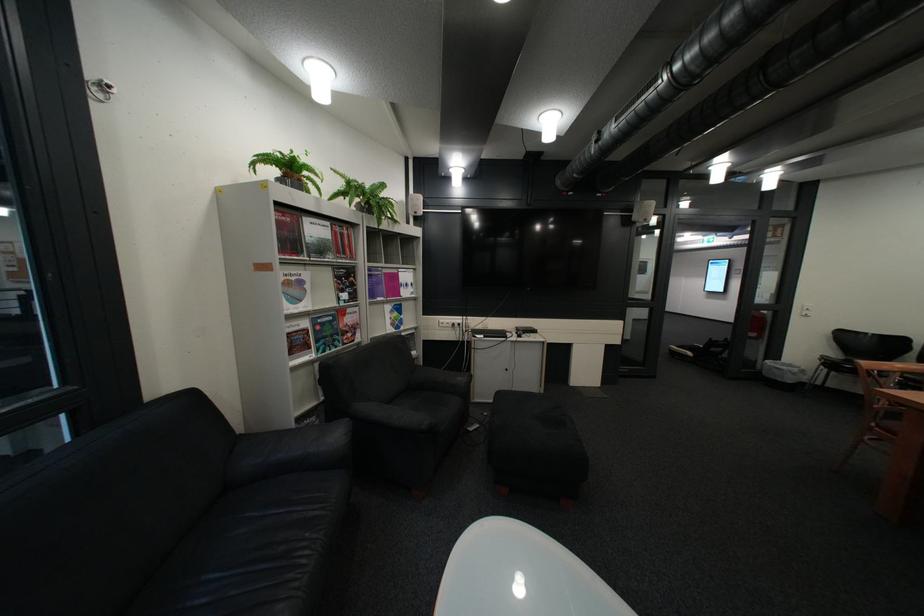
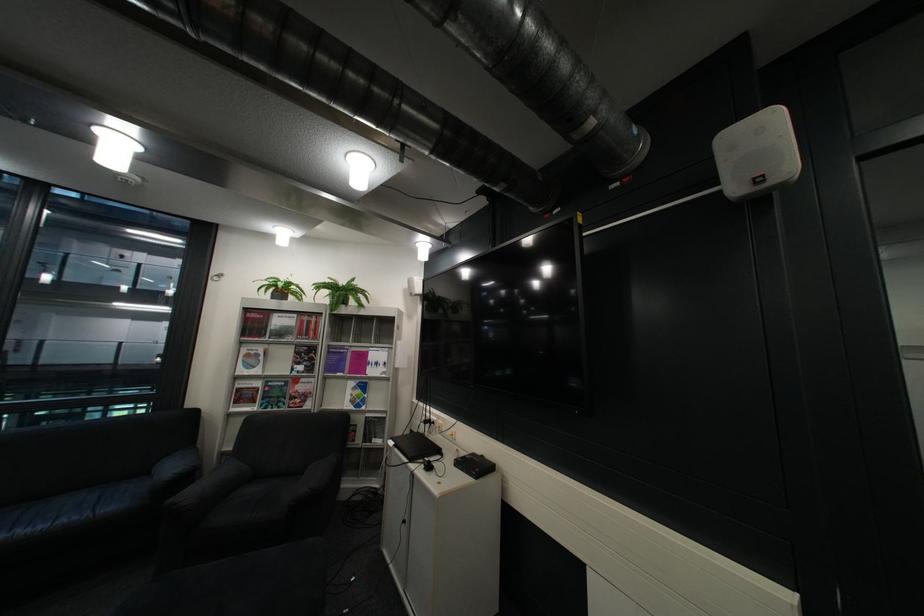
Locate, in the second image, the point that corresponds to the point at 344,331 in the first image.

(290, 394)